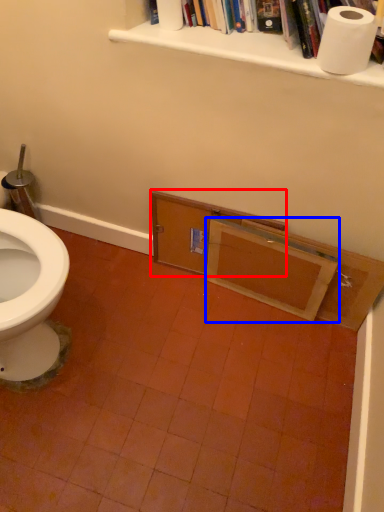
Question: Among these objects, which one is nearest to the camera, drawer (highlighted by a red box) or drawer (highlighted by a blue box)?

Choices:
 (A) drawer
 (B) drawer

Answer: (B)